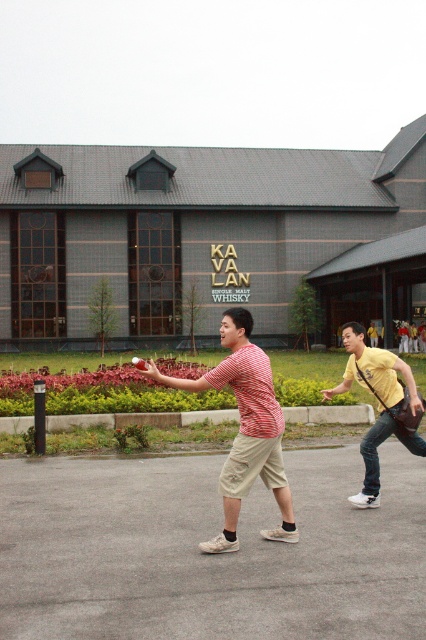
Which is more to the left, yellow cotton shirt at center or red plastic frisbee at center?

From the viewer's perspective, red plastic frisbee at center appears more on the left side.

Where is `yellow cotton shirt at center`? yellow cotton shirt at center is located at coordinates (379, 403).

Is gray brick building at center shorter than red plastic frisbee at center?

No, gray brick building at center is not shorter than red plastic frisbee at center.

Between gray brick building at center and red plastic frisbee at center, which one appears on the right side from the viewer's perspective?

gray brick building at center

Does point (72, 330) come in front of point (138, 365)?

No.

I want to click on gray brick building at center, so click(x=207, y=237).

Which is above, red striped shirt at center or yellow cotton shirt at center?

yellow cotton shirt at center is above.

Does red striped shirt at center appear over yellow cotton shirt at center?

No.

Between point (245, 465) and point (370, 355), which one is positioned behind?

Positioned behind is point (370, 355).

You are a GUI agent. You are given a task and a screenshot of the screen. Output one action in this format:
    pyautogui.click(x=<x>, y=<y>)
    Task: Click on the red striped shirt at center
    The width and height of the screenshot is (426, 640).
    Given the screenshot: What is the action you would take?
    pyautogui.click(x=244, y=428)